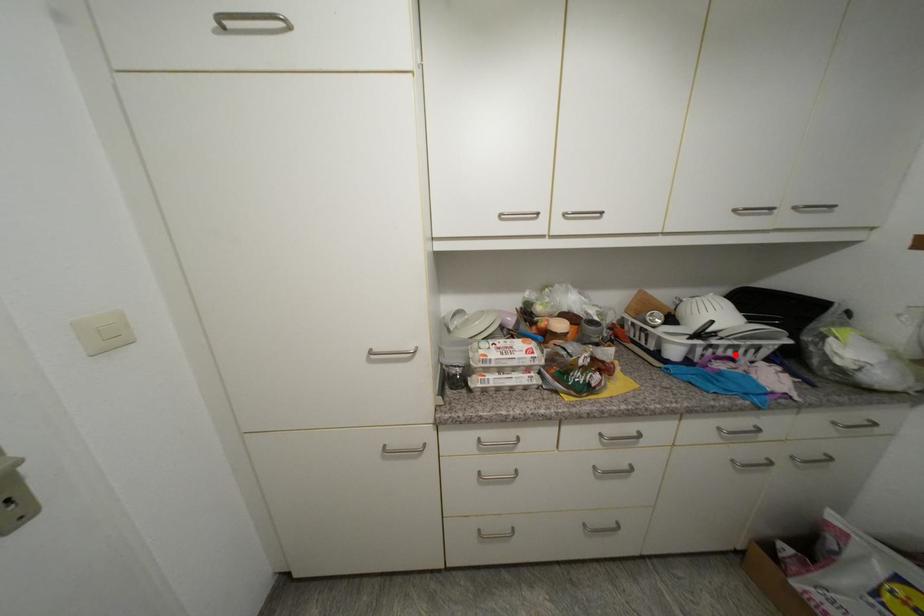
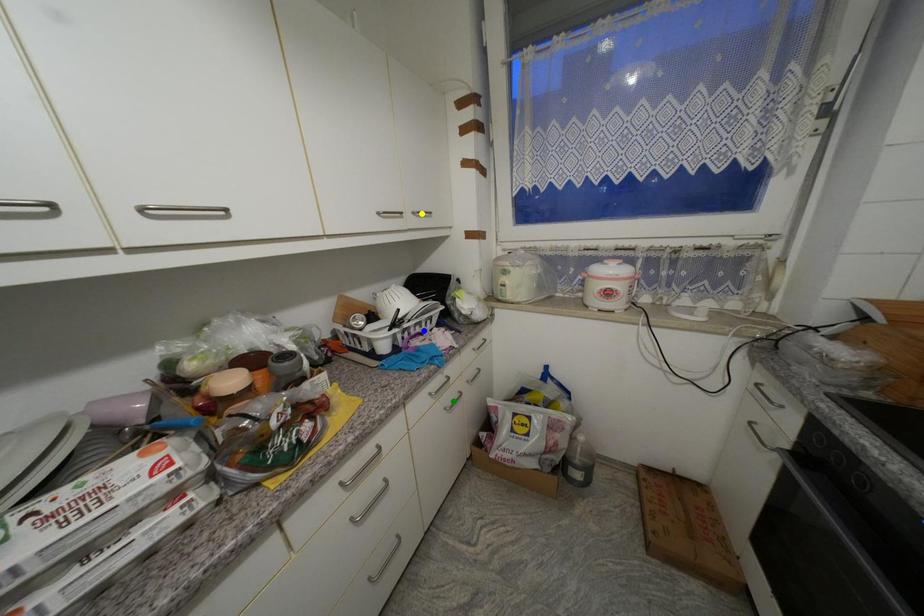
Question: I am providing you with two images of the same scene from different viewpoints. A red point is marked on the first image. You are given multiple points on the second image. Which point in image 2 is actually the same real-world point as the red point in image 1?

Choices:
 (A) blue point
 (B) yellow point
 (C) green point

Answer: (A)